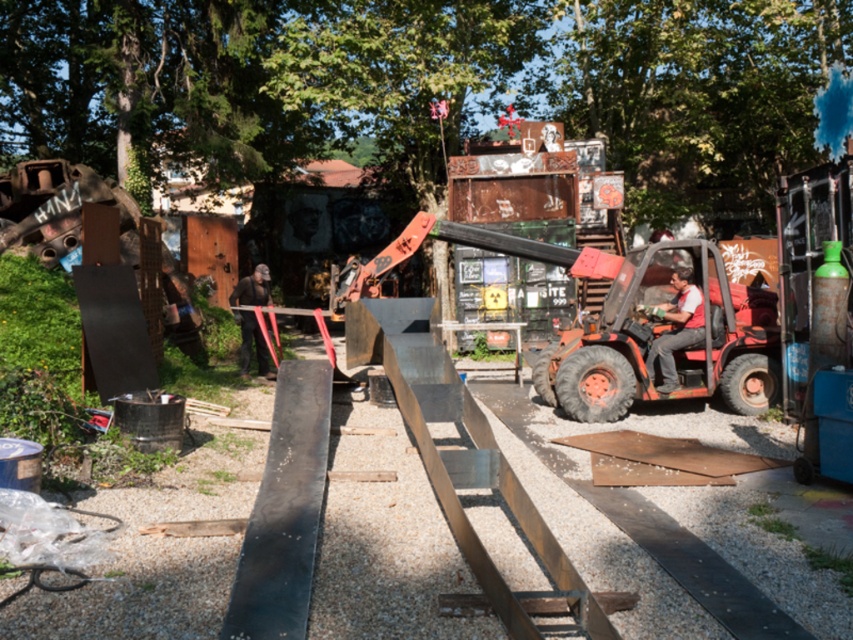
Is reddish-orange metal forklift at center-right to the right of black matte construction worker at center from the viewer's perspective?

Indeed, reddish-orange metal forklift at center-right is positioned on the right side of black matte construction worker at center.

What are the coordinates of `reddish-orange metal forklift at center-right` in the screenshot? It's located at (676, 326).

Is point (697, 308) farther from camera compared to point (238, 292)?

That is False.

Where is `reddish-orange metal forklift at center-right`? reddish-orange metal forklift at center-right is located at coordinates (676, 326).